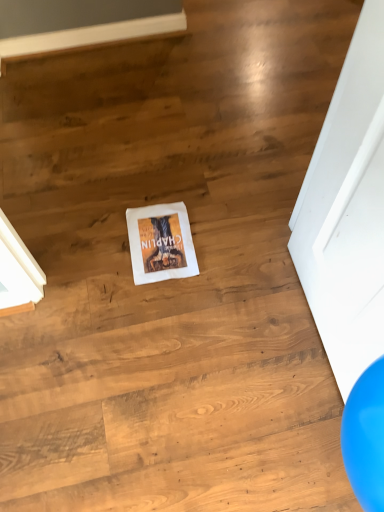
The height and width of the screenshot is (512, 384). Identify the location of vacant space situated on the left part of white cloth at center. (94, 242).